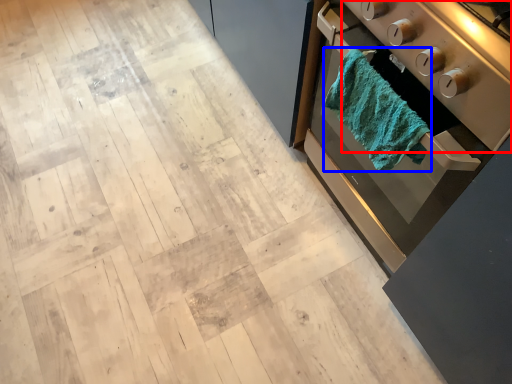
Question: Which object is closer to the camera taking this photo, appliance (highlighted by a red box) or bath towel (highlighted by a blue box)?

Choices:
 (A) appliance
 (B) bath towel

Answer: (A)